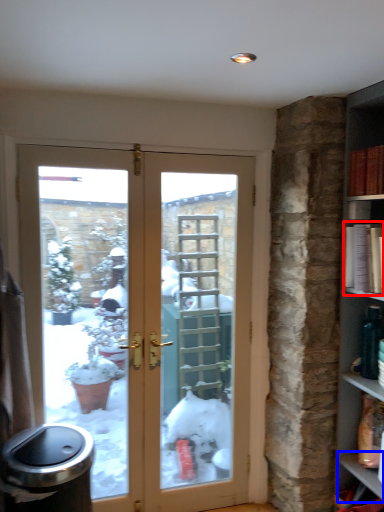
Question: Among these objects, which one is nearest to the camera, book (highlighted by a red box) or window sill (highlighted by a blue box)?

Choices:
 (A) book
 (B) window sill

Answer: (A)